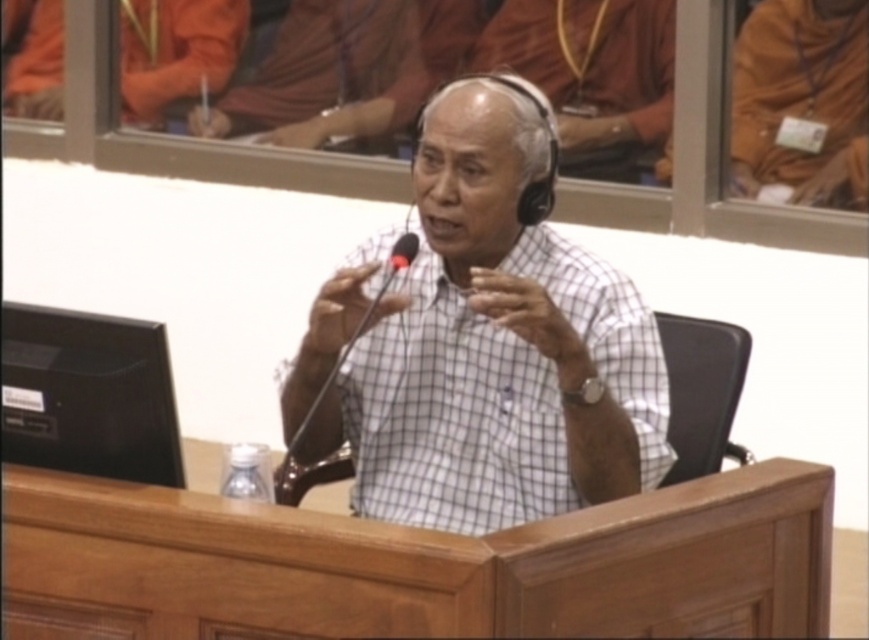
Question: Which object is closer to the camera taking this photo?

Choices:
 (A) black matte microphone at center
 (B) orange cloth at upper left
 (C) black plastic microphone at center

Answer: (C)

Question: Is white checkered shirt at center smaller than black plastic microphone at center?

Choices:
 (A) yes
 (B) no

Answer: (B)

Question: Does orange cloth at upper left appear over black plastic microphone at center?

Choices:
 (A) no
 (B) yes

Answer: (B)

Question: Which object appears farthest from the camera in this image?

Choices:
 (A) white checkered shirt at center
 (B) orange cloth at upper center
 (C) white matte headphones at upper center
 (D) black plastic microphone at center

Answer: (B)

Question: Does orange cloth at upper left appear under black plastic microphone at center?

Choices:
 (A) yes
 (B) no

Answer: (B)

Question: Among these points, which one is farthest from the camera?

Choices:
 (A) (157, 93)
 (B) (615, 64)
 (C) (343, 426)
 (D) (426, 58)

Answer: (A)